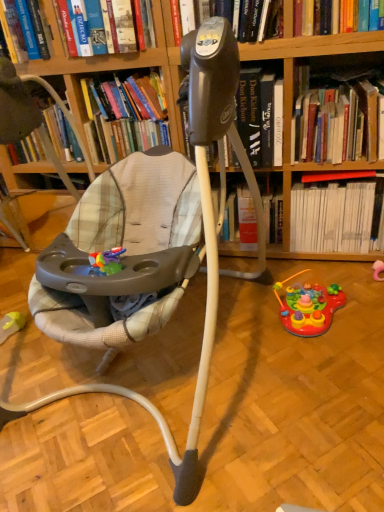
Where is `free space that is in between plush fabric baby carriage at center and rubberized plastic activity center at lower right, the 2th toy positioned from the right`? This screenshot has width=384, height=512. free space that is in between plush fabric baby carriage at center and rubberized plastic activity center at lower right, the 2th toy positioned from the right is located at coordinates [x=284, y=391].